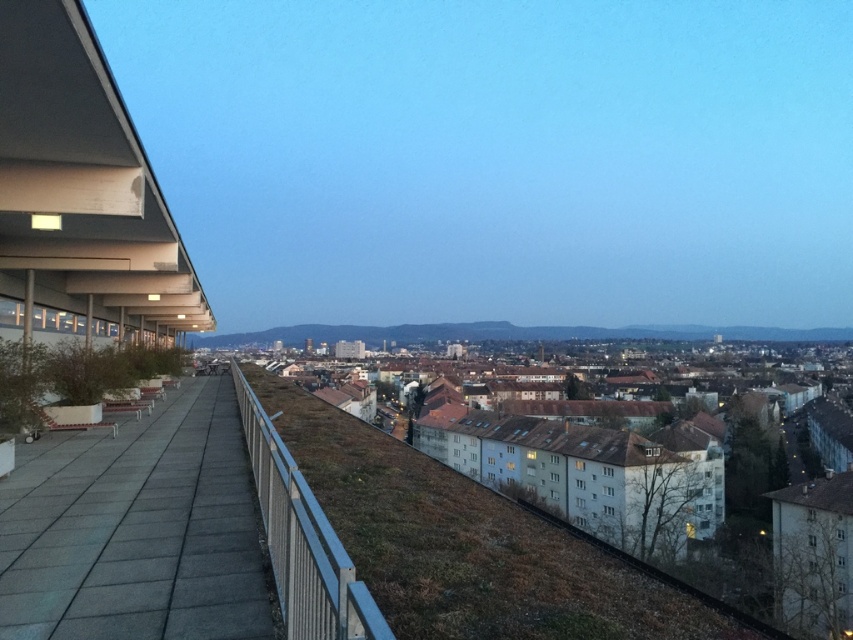
You are standing on the rooftop terrace and want to take a photo of both the point at coordinates point (131,502) and the point at coordinates point (492,573). Which point will appear closer to the edge of the photo frame?

Point (492,573) will appear closer to the edge of the photo frame because it is farther from the camera compared to point (131,502).

You are standing on the rooftop terrace and need to move from the gray tile pavement at lower left to the green grass at center. Which surface is higher in elevation?

The green grass at center is taller than the gray tile pavement at lower left, so the green grass at center is higher in elevation.